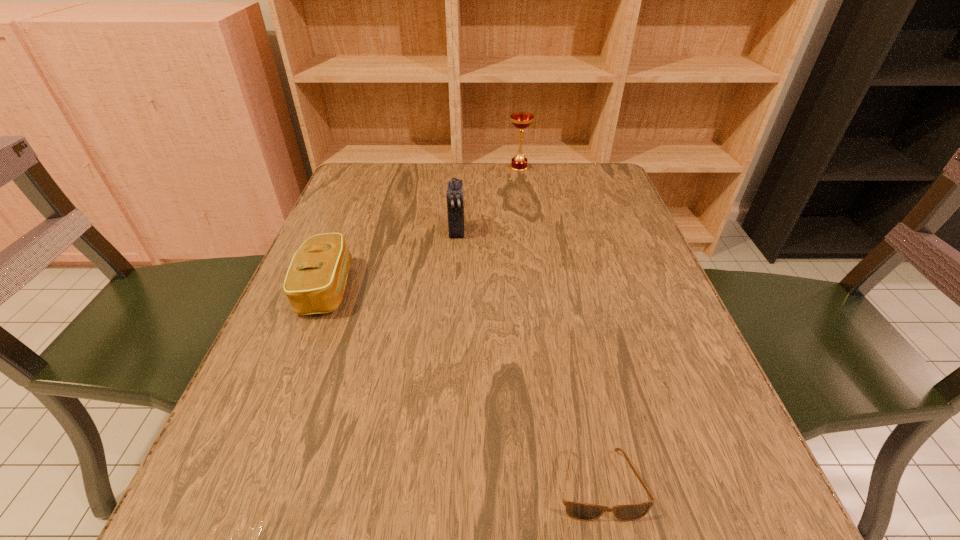
I want to click on free space between the third tallest object and the nearest object, so click(463, 386).

Where is `object that is the closest to the shorter clutch bag`? This screenshot has height=540, width=960. object that is the closest to the shorter clutch bag is located at coordinates 455,196.

Locate an element on the screen. The image size is (960, 540). the second closest object to the sunglasses is located at coordinates (455, 196).

You are a GUI agent. You are given a task and a screenshot of the screen. Output one action in this format:
    pyautogui.click(x=<x>, y=<y>)
    Task: Click on the free space that satisfies the following two spatial constraints: 1. with the zip open on the third object from right to left; 2. on the zipper side of the third tallest object
    The width and height of the screenshot is (960, 540).
    Given the screenshot: What is the action you would take?
    pyautogui.click(x=453, y=288)